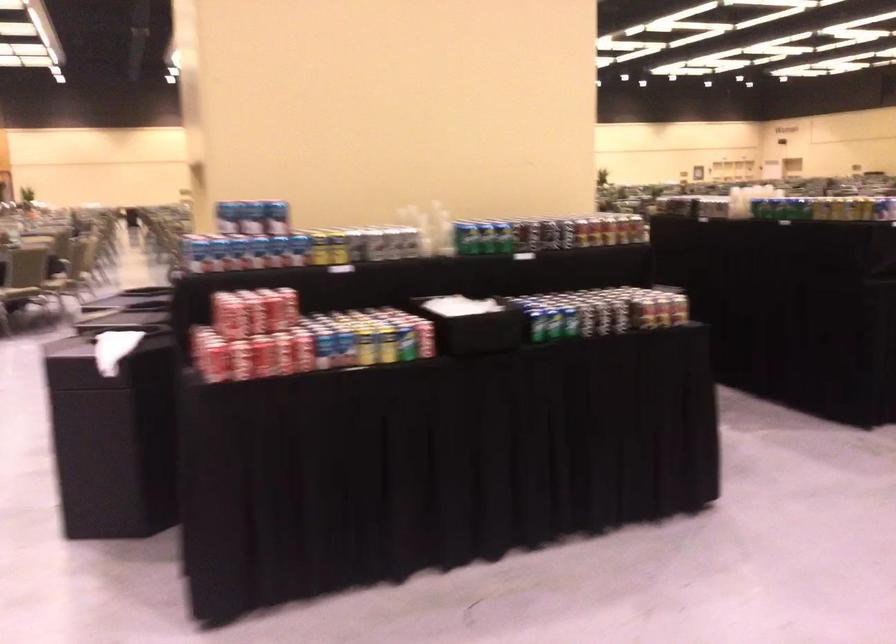
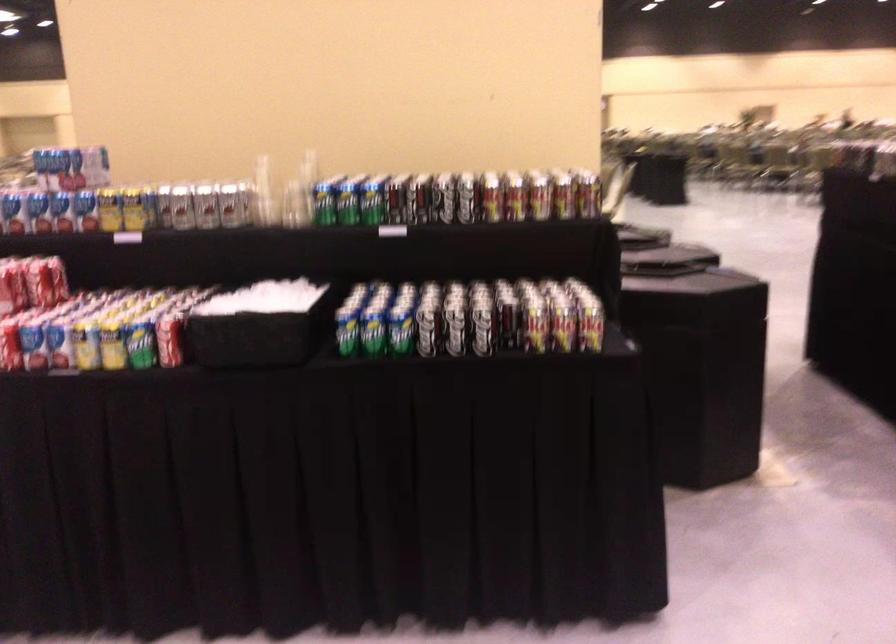
Where in the second image is the point corresponding to the point at 348,245 from the first image?

(162, 205)